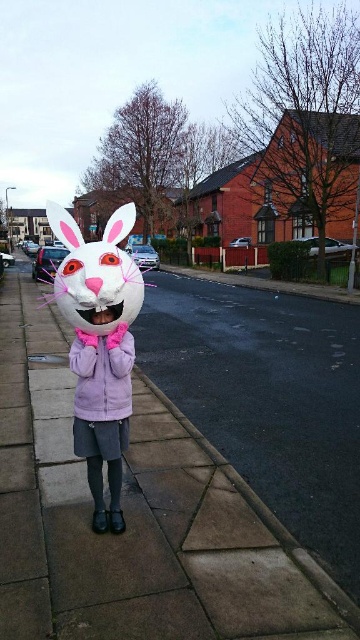
Question: Among these objects, which one is nearest to the camera?

Choices:
 (A) matte concrete pavement at center
 (B) white matte bunny at center
 (C) purple fleece jacket at center

Answer: (A)

Question: Estimate the real-world distances between objects in this image. Which object is farther from the white matte bunny at center?

Choices:
 (A) purple fleece jacket at center
 (B) matte white bunny mask at center

Answer: (A)

Question: Is matte concrete pavement at center smaller than matte white bunny mask at center?

Choices:
 (A) no
 (B) yes

Answer: (B)

Question: Does matte concrete pavement at center appear over purple fleece jacket at center?

Choices:
 (A) no
 (B) yes

Answer: (A)

Question: Is matte white bunny mask at center to the left of purple fleece jacket at center from the viewer's perspective?

Choices:
 (A) yes
 (B) no

Answer: (A)

Question: Considering the real-world distances, which object is closest to the matte concrete pavement at center?

Choices:
 (A) matte white bunny mask at center
 (B) purple fleece jacket at center

Answer: (A)